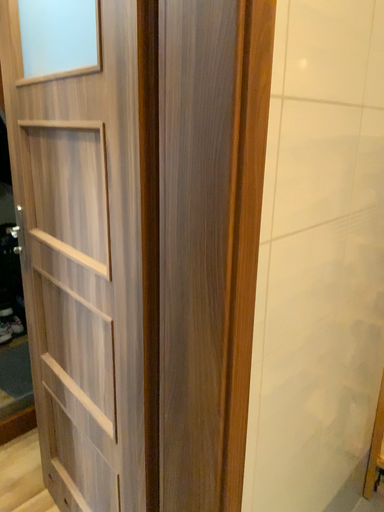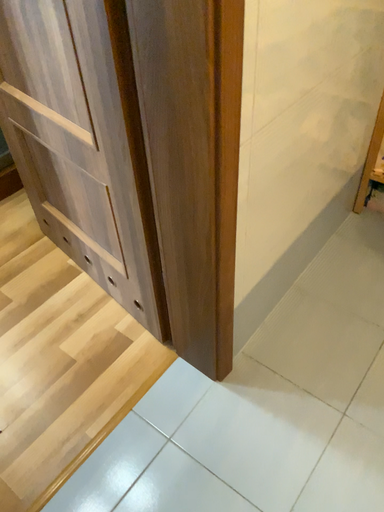
Question: How did the camera likely rotate when shooting the video?

Choices:
 (A) rotated upward
 (B) rotated downward

Answer: (B)